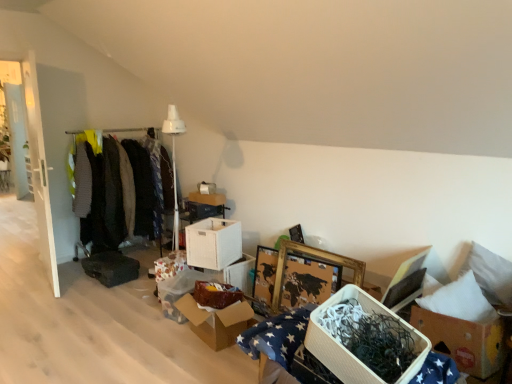
Where is `vacant space that is to the left of cardboard box at center, which is counted as the 2th cardboard box, starting from the front`? Image resolution: width=512 pixels, height=384 pixels. vacant space that is to the left of cardboard box at center, which is counted as the 2th cardboard box, starting from the front is located at coordinates (151, 342).